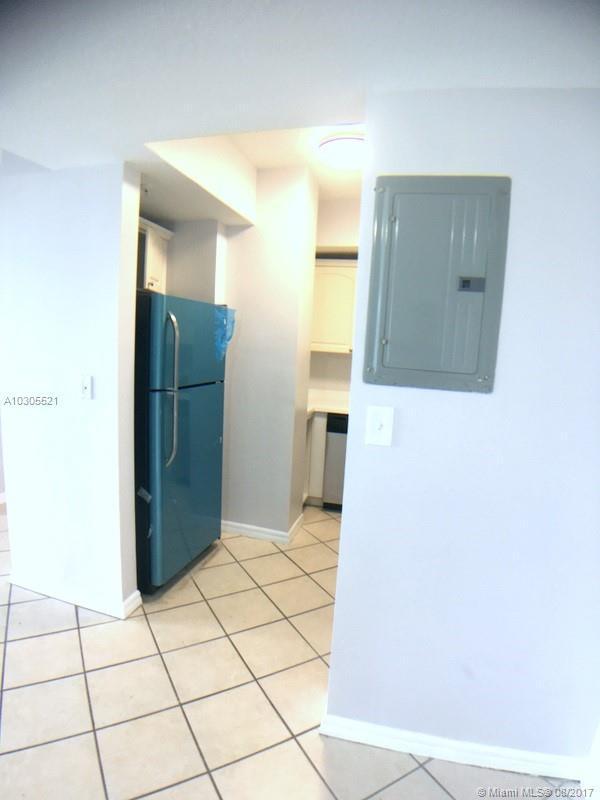
The image size is (600, 800). In order to click on white moulding on bottom of walls in this screenshot , I will do `click(453, 756)`, `click(136, 602)`, `click(280, 538)`, `click(39, 588)`.